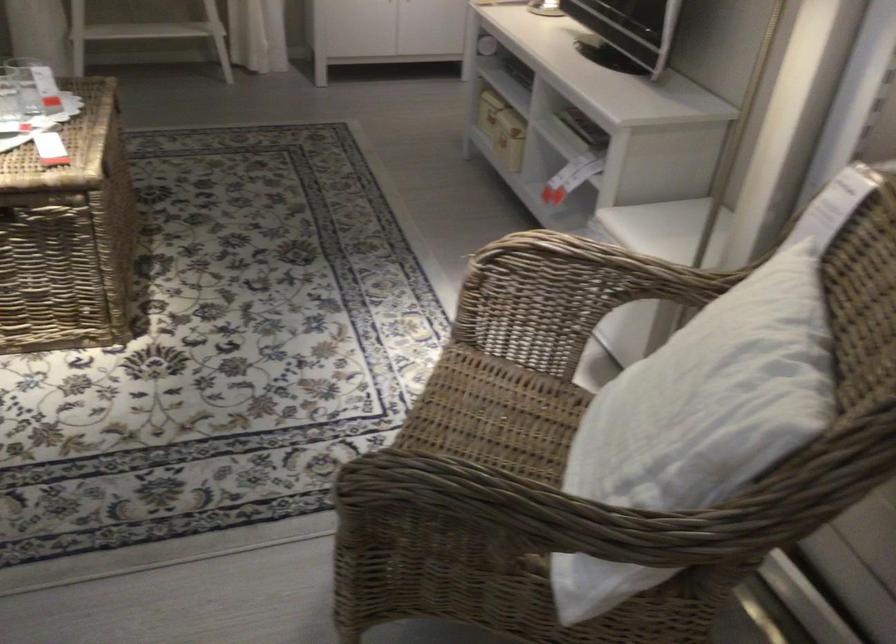
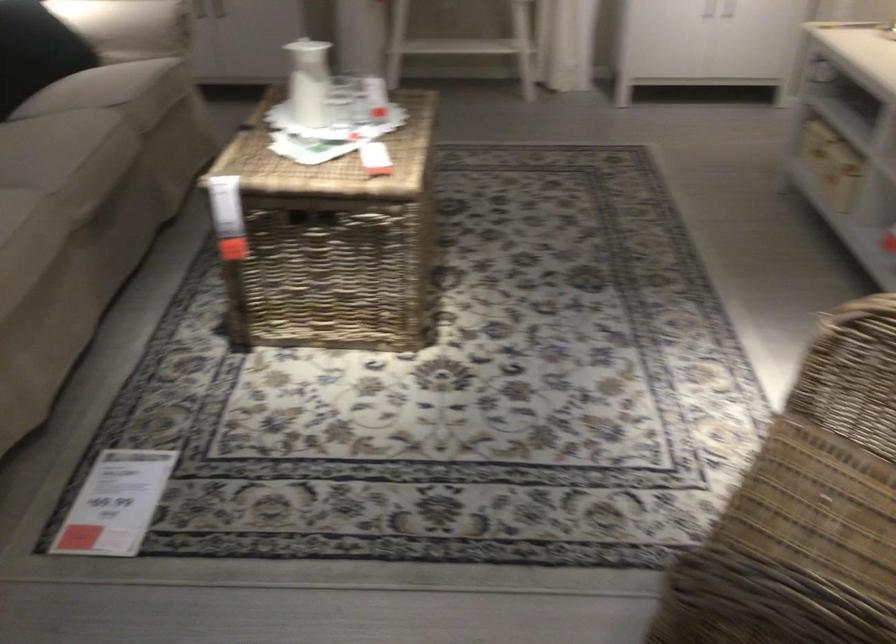
Question: The camera is either moving clockwise (left) or counter-clockwise (right) around the object. The first image is from the beginning of the video and the second image is from the end. Is the camera moving left or right when shooting the video?

Choices:
 (A) Left
 (B) Right

Answer: (B)